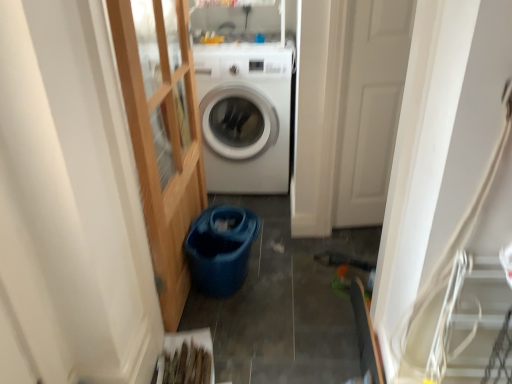
Identify the location of vacant space to the right of clear glass door at left. (295, 271).